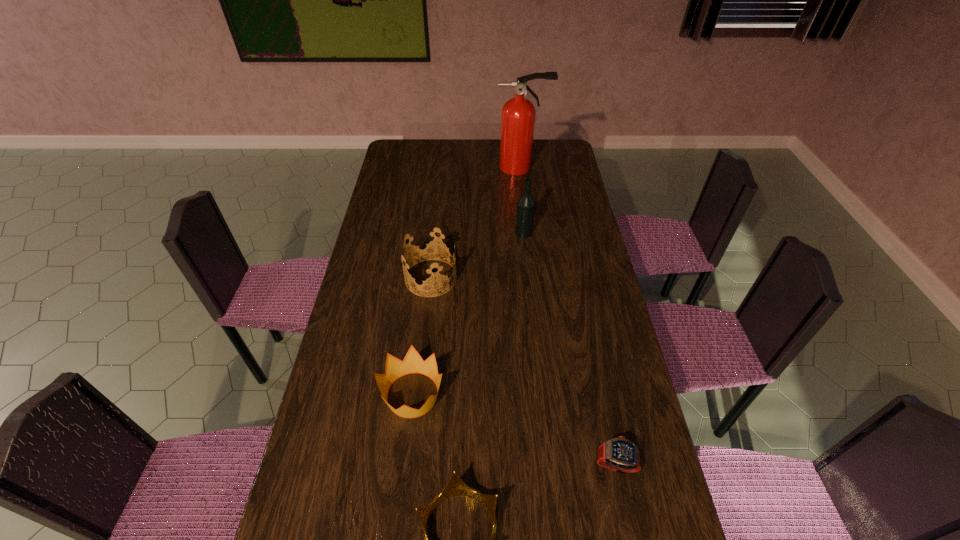
At what (x,y) coordinates should I click in order to perform the action: click on vacant space at the left edge. Please return your answer as a coordinate pair (x, y). This screenshot has height=540, width=960. Looking at the image, I should click on [x=294, y=538].

In the image, there is a desktop. Where is `vacant space at the right edge`? The image size is (960, 540). vacant space at the right edge is located at coordinates (571, 312).

In the image, there is a desktop. At what (x,y) coordinates should I click in order to perform the action: click on vacant space at the far right corner. Please return your answer as a coordinate pair (x, y). Looking at the image, I should click on (550, 140).

Find the location of `free spot between the tallest object and the third farthest object`. free spot between the tallest object and the third farthest object is located at coordinates (476, 222).

You are a GUI agent. You are given a task and a screenshot of the screen. Output one action in this format:
    pyautogui.click(x=<x>, y=<y>)
    Task: Click on the unoccupied area between the farthest object and the second nearest crown
    The height and width of the screenshot is (540, 960).
    Given the screenshot: What is the action you would take?
    pyautogui.click(x=467, y=281)

What are the coordinates of `empty space between the fire extinguisher and the third nearest object` in the screenshot? It's located at (467, 281).

Identify the location of vacant area that lies between the tallest crown and the shortest object. (523, 371).

Locate an element on the screen. The image size is (960, 540). object that is the fifth closest to the tallest crown is located at coordinates (619, 454).

Find the location of a particular element. the fifth closest object to the vodka is located at coordinates (455, 486).

Identify which crown is the second closest to the fourth shortest object. Please provide its 2D coordinates. Your answer should be formatted as a tuple, i.e. [(x, y)], where the tuple contains the x and y coordinates of a point satisfying the conditions above.

[(455, 486)]